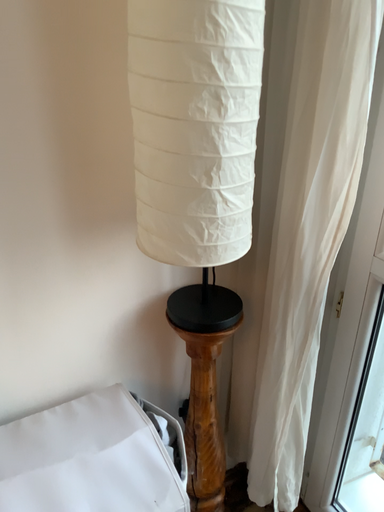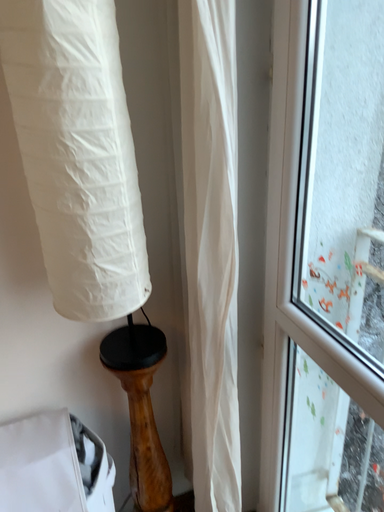
Question: How did the camera likely rotate when shooting the video?

Choices:
 (A) rotated right
 (B) rotated left

Answer: (B)